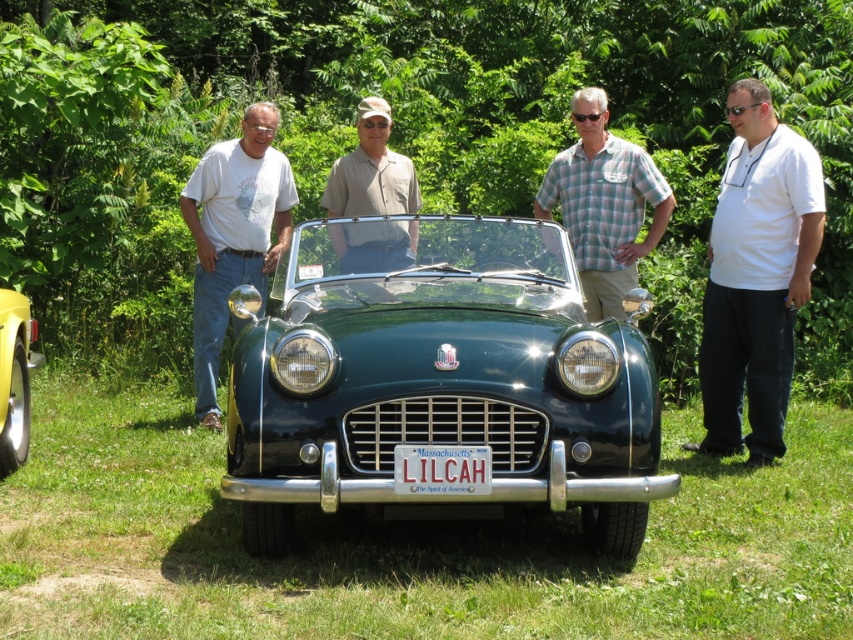
You are a photographer trying to capture a group photo of the men and the vintage car. You want to ensure that both the white smooth shirt at center and the yellow matte car at lower left are clearly visible in the frame. Based on their sizes, which object should you prioritize positioning closer to the camera to ensure it doesn

The white smooth shirt at center should be positioned closer to the camera because it might be wider than the yellow matte car at lower left, ensuring it fits well within the frame.